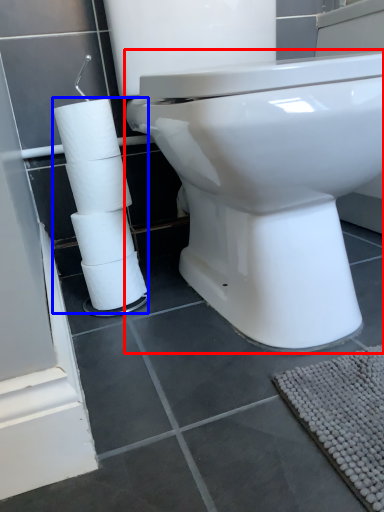
Question: Which point is further to the camera, toilet (highlighted by a red box) or toilet paper (highlighted by a blue box)?

Choices:
 (A) toilet
 (B) toilet paper

Answer: (B)